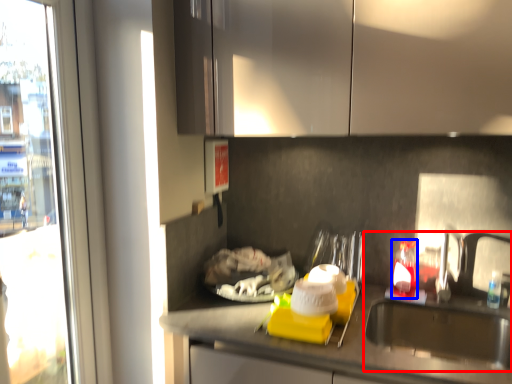
Question: Which object appears farthest to the camera in this image, sink (highlighted by a red box) or bottle (highlighted by a blue box)?

Choices:
 (A) sink
 (B) bottle

Answer: (B)